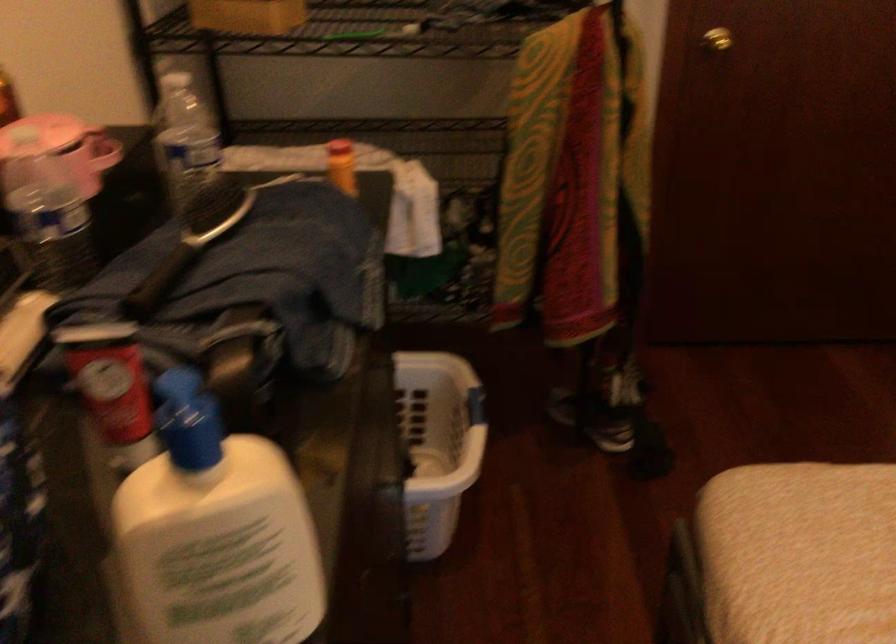
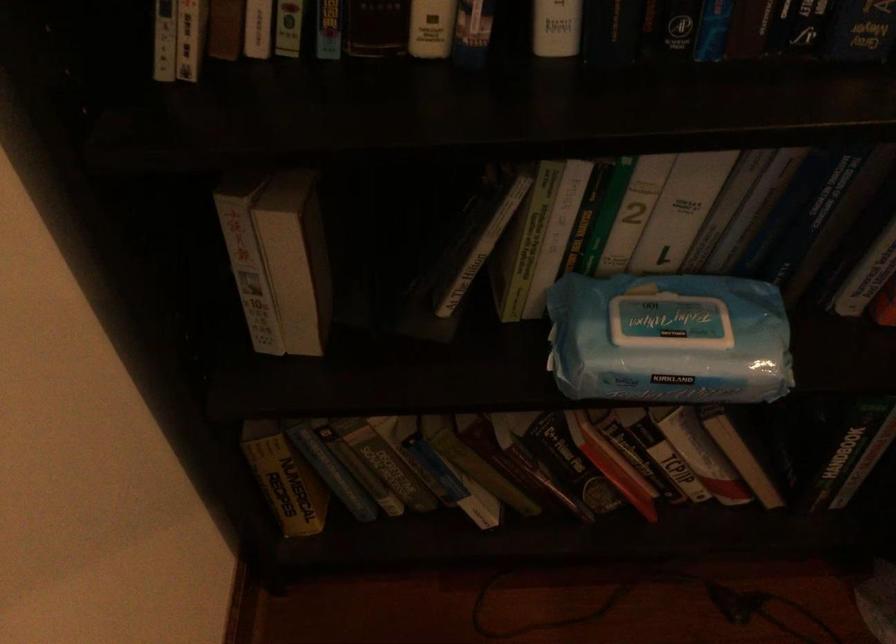
Consider the image. How did the camera likely rotate?

The camera rotated toward left-down.